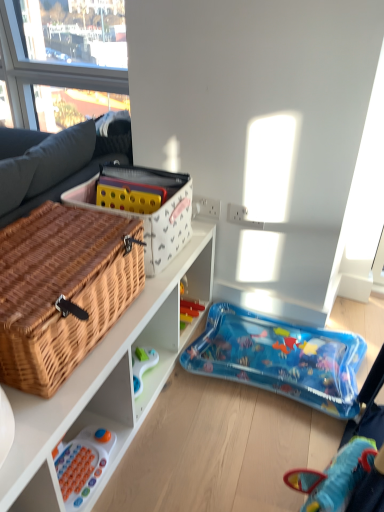
Find the location of `free location in front of blue inflatable pool at lower right, the first toy when ordered from top to bottom`. free location in front of blue inflatable pool at lower right, the first toy when ordered from top to bottom is located at coordinates (241, 449).